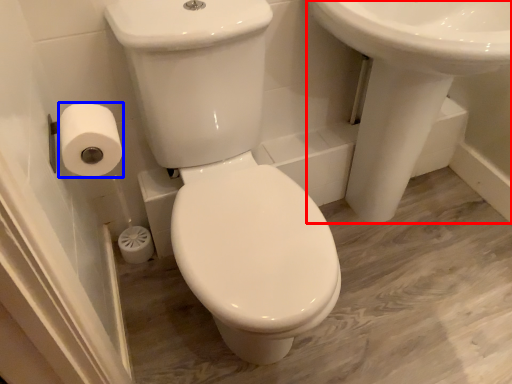
Question: Which of the following is the farthest to the observer, sink (highlighted by a red box) or toilet paper (highlighted by a blue box)?

Choices:
 (A) sink
 (B) toilet paper

Answer: (B)